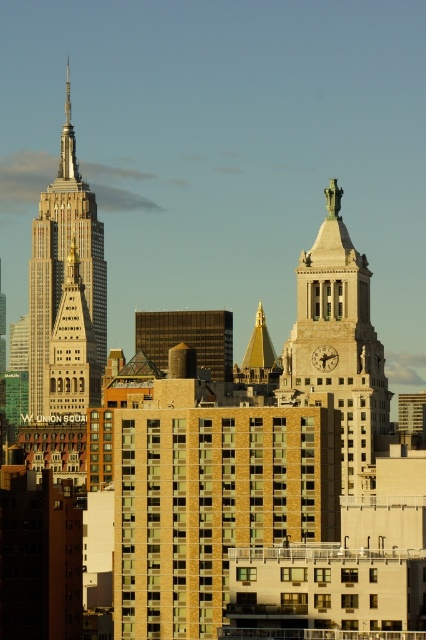
What do you see at coordinates (337, 346) in the screenshot? The width and height of the screenshot is (426, 640). I see `golden stone clock tower at center` at bounding box center [337, 346].

Does golden stone clock tower at center appear on the left side of white marble skyscraper at center?

Incorrect, golden stone clock tower at center is not on the left side of white marble skyscraper at center.

Does point (328, 192) come closer to viewer compared to point (37, 323)?

No, it is behind (37, 323).

The width and height of the screenshot is (426, 640). What are the coordinates of `golden stone clock tower at center` in the screenshot? It's located at point(337,346).